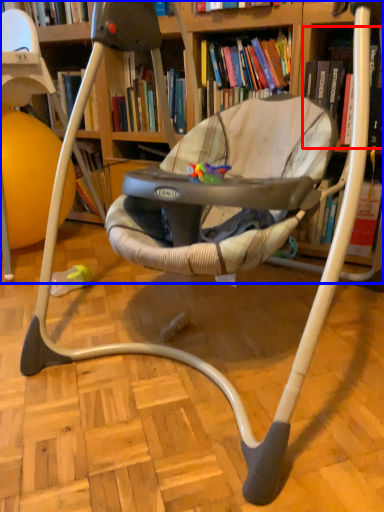
Question: Which of the following is the closest to the observer, book (highlighted by a red box) or bookcase (highlighted by a blue box)?

Choices:
 (A) book
 (B) bookcase

Answer: (B)